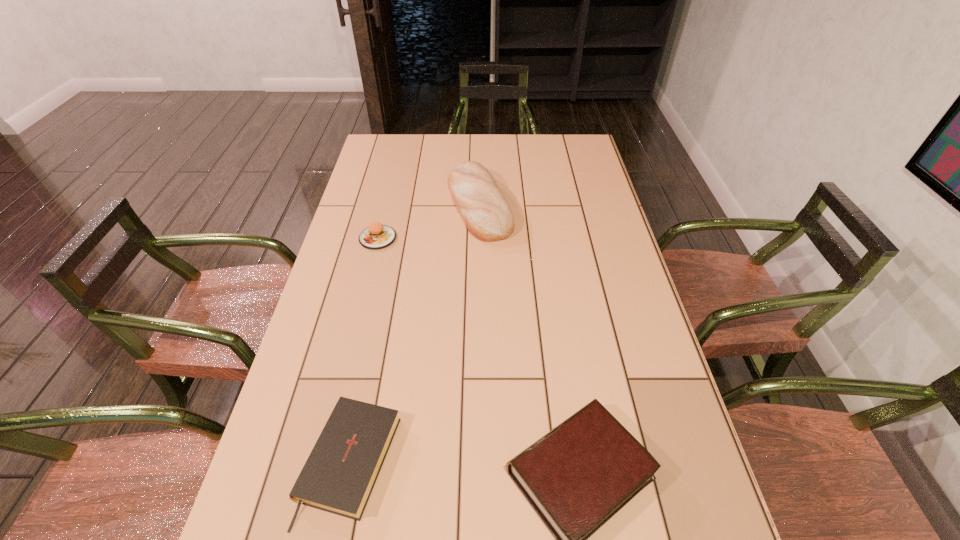
Locate an element on the screen. The width and height of the screenshot is (960, 540). bread is located at coordinates (487, 215).

Identify the location of patty. This screenshot has width=960, height=540. (377, 236).

Find the location of a particular element. The image size is (960, 540). the shortest object is located at coordinates (339, 475).

Where is `the left Bible`? The width and height of the screenshot is (960, 540). the left Bible is located at coordinates (339, 475).

This screenshot has height=540, width=960. Identify the location of vacant position located on the back of the bread. (480, 142).

This screenshot has width=960, height=540. I want to click on vacant space located 0.170m on the right of the patty, so click(x=450, y=238).

Identify the location of free point located 0.260m on the back of the shortest object. (380, 316).

Where is `patty present at the left edge`? patty present at the left edge is located at coordinates (377, 236).

The width and height of the screenshot is (960, 540). Find the location of `Bible that is at the left edge`. Bible that is at the left edge is located at coordinates click(339, 475).

Where is `free location at the far edge of the desktop`? free location at the far edge of the desktop is located at coordinates (539, 137).